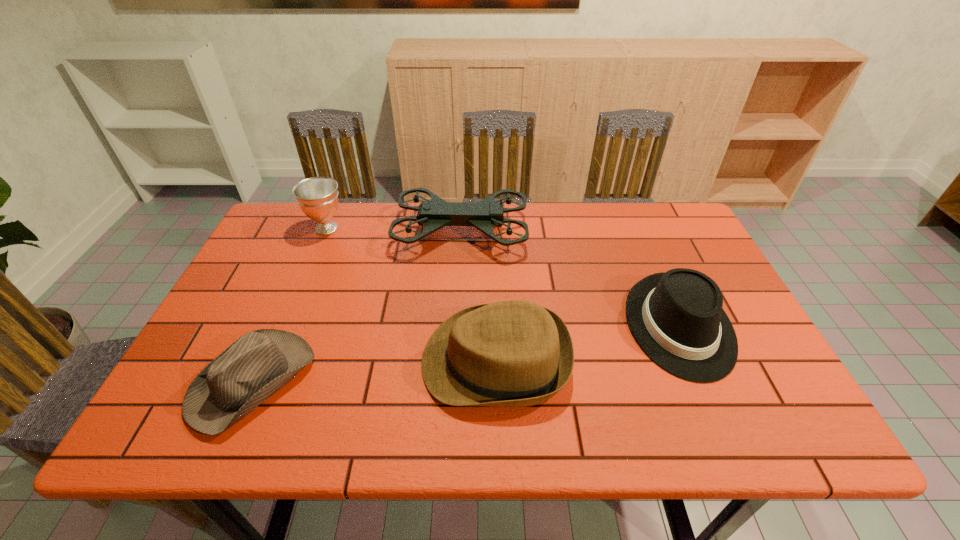
At what (x,y) coordinates should I click in order to perform the action: click on drone. Please return your answer as a coordinate pair (x, y). Looking at the image, I should click on (485, 215).

Find the location of a particular element. Image resolution: width=960 pixels, height=540 pixels. chalice is located at coordinates (317, 197).

Find the location of a particular element. Image resolution: width=960 pixels, height=540 pixels. the rightmost object is located at coordinates (676, 317).

I want to click on the second fedora from left to right, so click(x=515, y=353).

Identify the location of the shortest object. The image size is (960, 540). (255, 366).

I want to click on the leftmost fedora, so click(x=255, y=366).

The image size is (960, 540). Identify the location of vacant space located 0.360m on the right of the drone. (643, 232).

Find the location of a particular element. The image size is (960, 540). blank area located 0.300m on the front of the second tallest object is located at coordinates (290, 315).

Identify the location of vacant space located 0.070m on the front-facing side of the rightmost fedora. (716, 413).

Where is `free region located 0.290m on the front-facing side of the second fedora from left to right`? This screenshot has height=540, width=960. free region located 0.290m on the front-facing side of the second fedora from left to right is located at coordinates pyautogui.click(x=295, y=361).